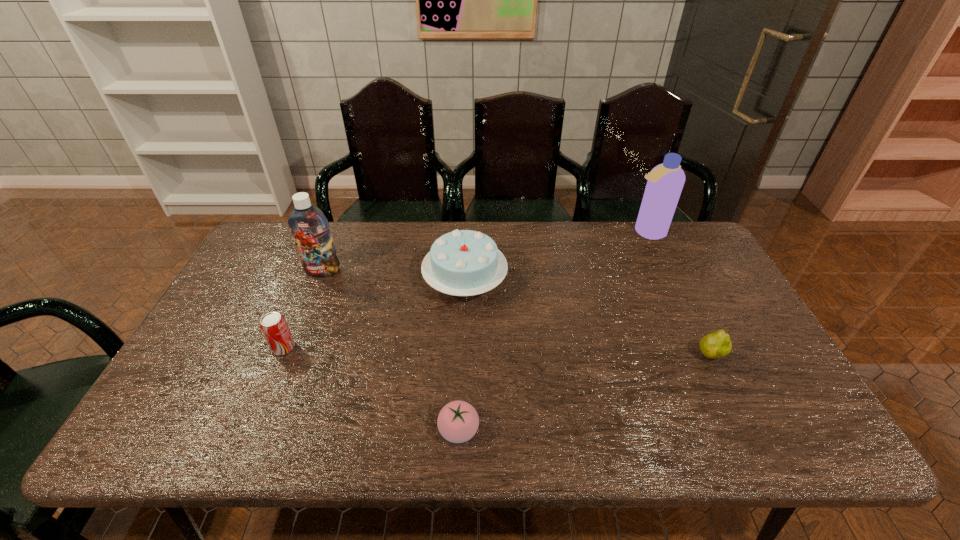
Where is `free space that satisfies the following two spatial constraints: 1. on the front surface of the fourth object from right to left; 2. on the right side of the sixth farthest detergent`? The width and height of the screenshot is (960, 540). free space that satisfies the following two spatial constraints: 1. on the front surface of the fourth object from right to left; 2. on the right side of the sixth farthest detergent is located at coordinates (567, 357).